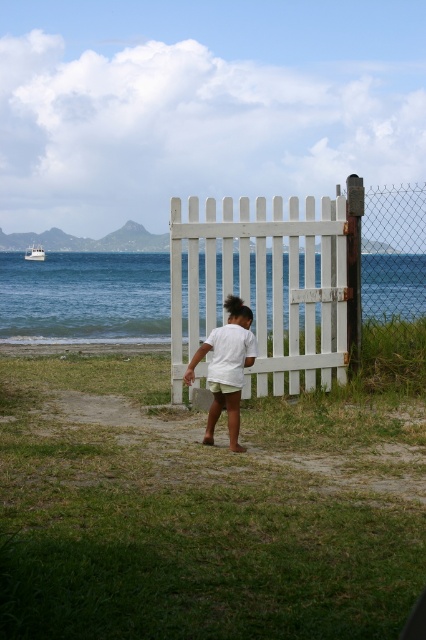
You are a photographer trying to capture the scene with a wide angle lens. You notice the green grass at center and the white matte shorts at center. Which object will appear wider in the photo?

The green grass at center will appear wider in the photo because its width is larger than that of the white matte shorts at center.

You are standing at the white wooden gate and want to walk to the green grass at center. What direction should you walk in?

You should walk forward towards the green grass at center, as it is located directly ahead of the gate at point [193,515].

You are a parent trying to decide if your child wearing the white matte shorts at center can play safely on the green grass at center without getting their shorts dirty. Based on the scene, can you determine if the grass is shorter than the shorts?

The green grass at center has a lesser height compared to white matte shorts at center, so yes, the grass is shorter than the shorts, meaning the child can play safely without getting their shorts dirty.